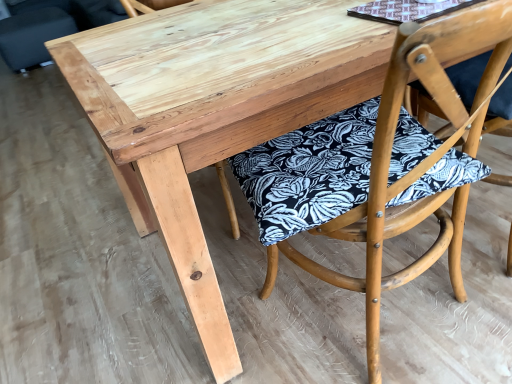
At what (x,y) coordinates should I click in order to perform the action: click on wooden chair with floral cushion at lower right. Please return your answer as a coordinate pair (x, y). Looking at the image, I should click on (417, 165).

What do you see at coordinates (417, 165) in the screenshot? The width and height of the screenshot is (512, 384). I see `wooden chair with floral cushion at lower right` at bounding box center [417, 165].

In order to face wooden chair with floral cushion at lower right, should I rotate leftwards or rightwards?

It's best to rotate right around 16.214 degrees.

At what (x,y) coordinates should I click in order to perform the action: click on wooden chair with floral cushion at lower right. Please return your answer as a coordinate pair (x, y). The width and height of the screenshot is (512, 384). Looking at the image, I should click on (417, 165).